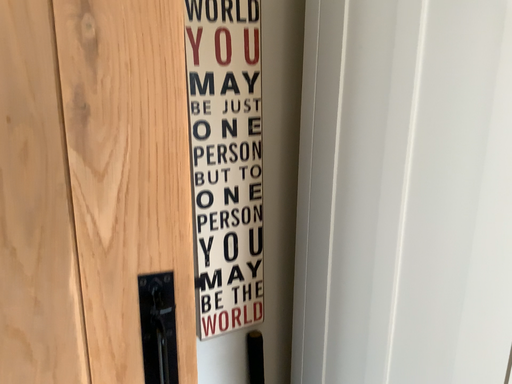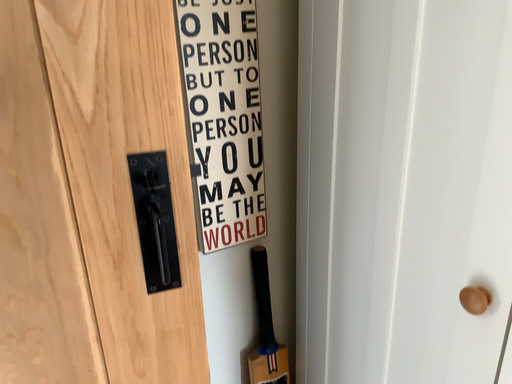
Question: How did the camera likely rotate when shooting the video?

Choices:
 (A) rotated upward
 (B) rotated downward

Answer: (B)